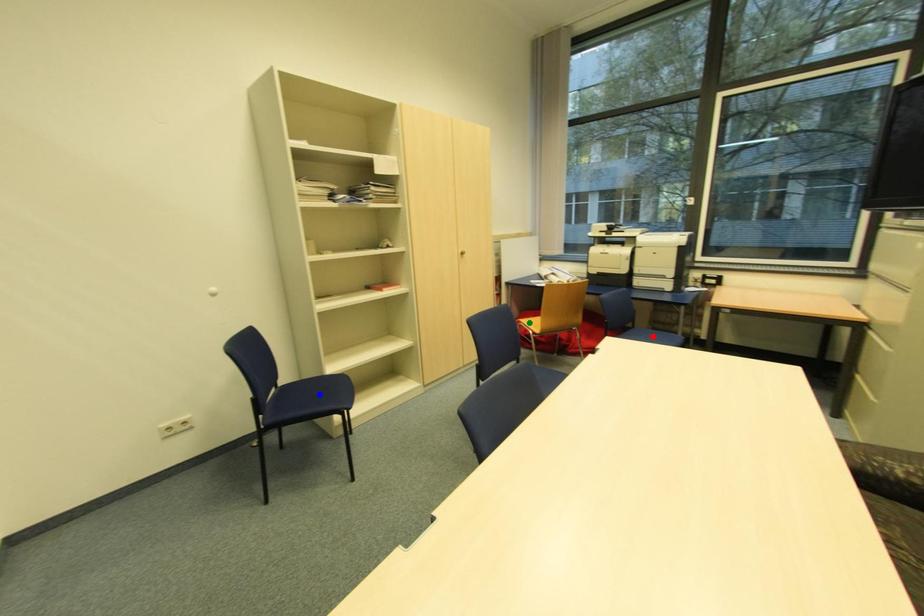
Order these from nearest to farthest:
blue point
red point
green point

blue point
red point
green point